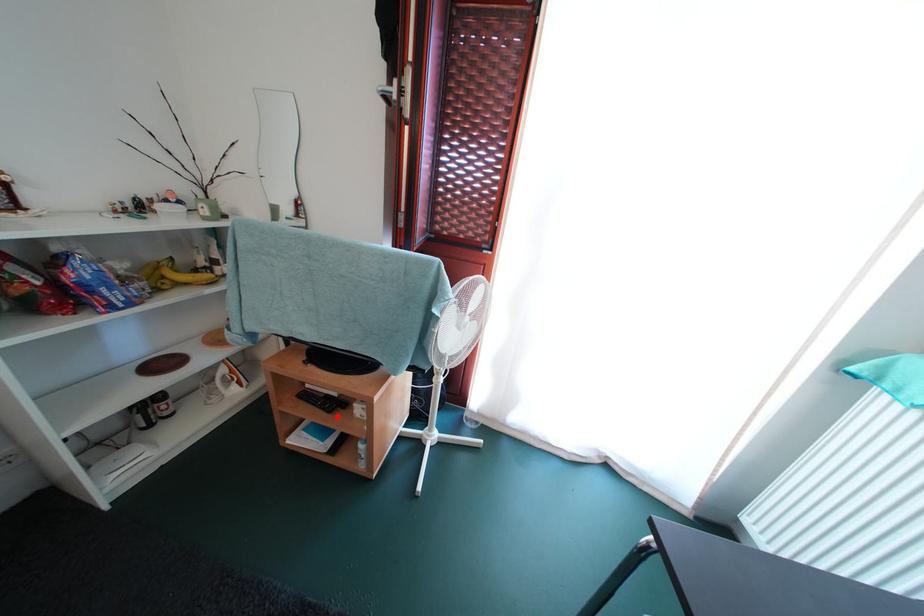
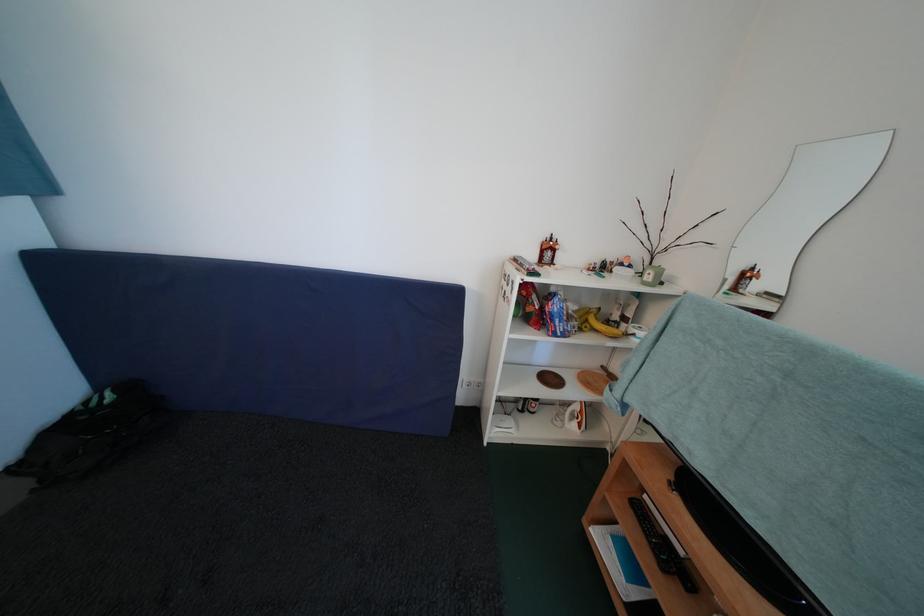
In the second image, find the point that corresponds to the highlighted location in the first image.

(671, 573)